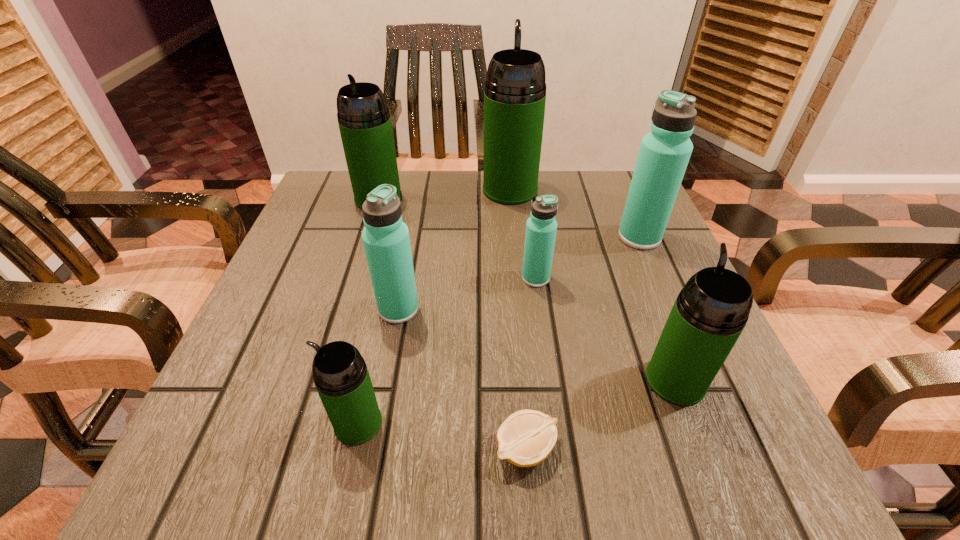
At what (x,y) coordinates should I click in order to perform the action: click on free space that satisfies the following two spatial constraints: 1. from the spout of the farthest aqua thermos bottle; 2. on the right side of the second smallest green thermos bottle. Please return your answer as a coordinate pair (x, y). Image resolution: width=960 pixels, height=540 pixels. Looking at the image, I should click on (621, 237).